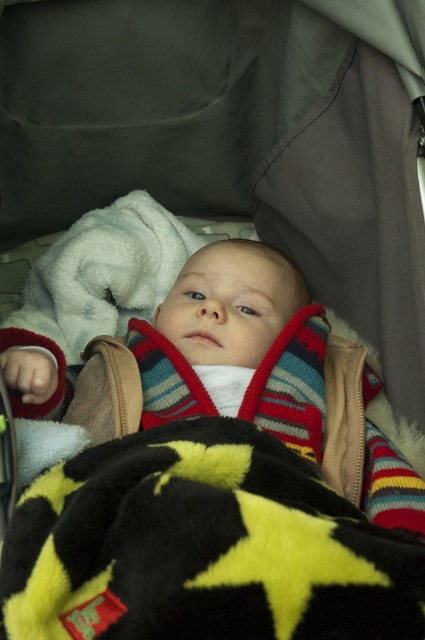
You are a parent holding a small toy that is 12 inches long. You want to place it near the point at coordinate (192, 449) so that your baby can reach it while lying in the stroller. Is the toy within the baby reach? Assume the baby can reach 24 inches from them.

The distance of point (192, 449) from viewer is 24.58 inches. Since the baby can reach up to 24 inches, the toy placed at that point would be slightly out of reach.

Based on the scene description, where is the fluffy black blanket with yellow stars at center located in terms of its 2D coordinates?

The fluffy black blanket with yellow stars at center is located at the 2D coordinates of point (201,547).